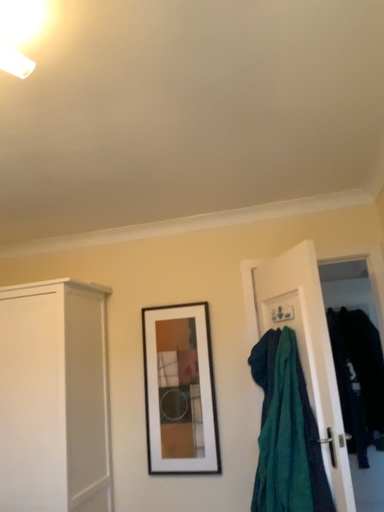
Question: From the image's perspective, is wooden framed artwork at center positioned above or below teal fabric at right?

Choices:
 (A) above
 (B) below

Answer: (B)

Question: Looking at their shapes, would you say wooden framed artwork at center is wider or thinner than teal fabric at right?

Choices:
 (A) thin
 (B) wide

Answer: (A)

Question: Estimate the real-world distances between objects in this image. Which object is closer to the dark blue fabric at right?

Choices:
 (A) white matte cabinet at left
 (B) wooden framed artwork at center
 (C) teal fabric at right

Answer: (C)

Question: Considering the real-world distances, which object is closest to the wooden framed artwork at center?

Choices:
 (A) white matte cabinet at left
 (B) teal fabric at right
 (C) dark blue fabric at right

Answer: (A)